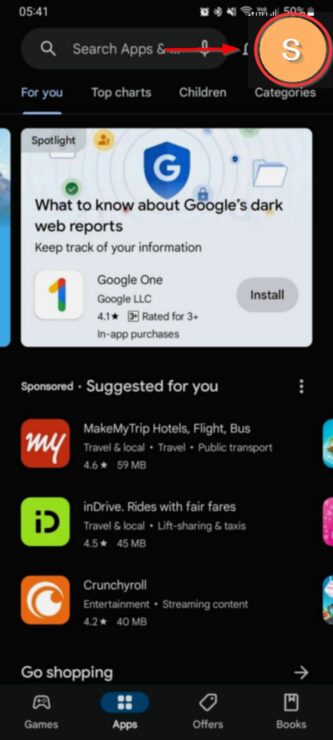
Locate an element on the screen. books is located at coordinates (295, 707).